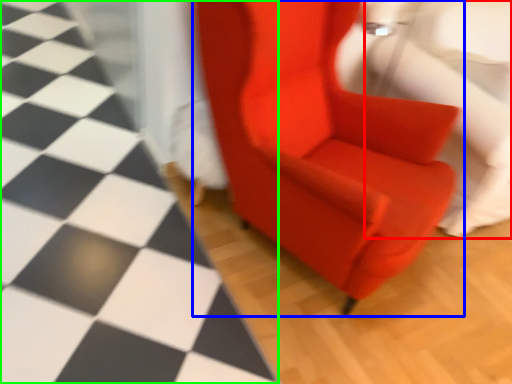
Question: Considering the real-world distances, which object is farthest from swivel chair (highlighted by a red box)? chair (highlighted by a blue box) or tile (highlighted by a green box)?

Choices:
 (A) chair
 (B) tile

Answer: (B)